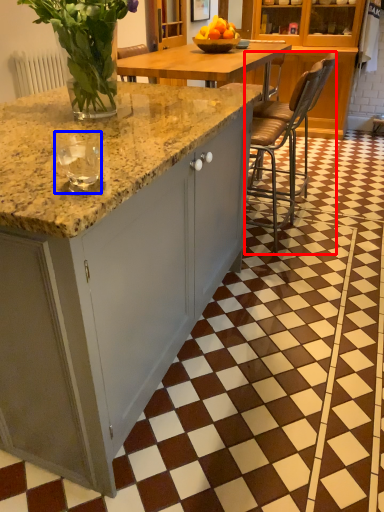
Question: Which object appears farthest to the camera in this image, chair (highlighted by a red box) or wine glass (highlighted by a blue box)?

Choices:
 (A) chair
 (B) wine glass

Answer: (A)